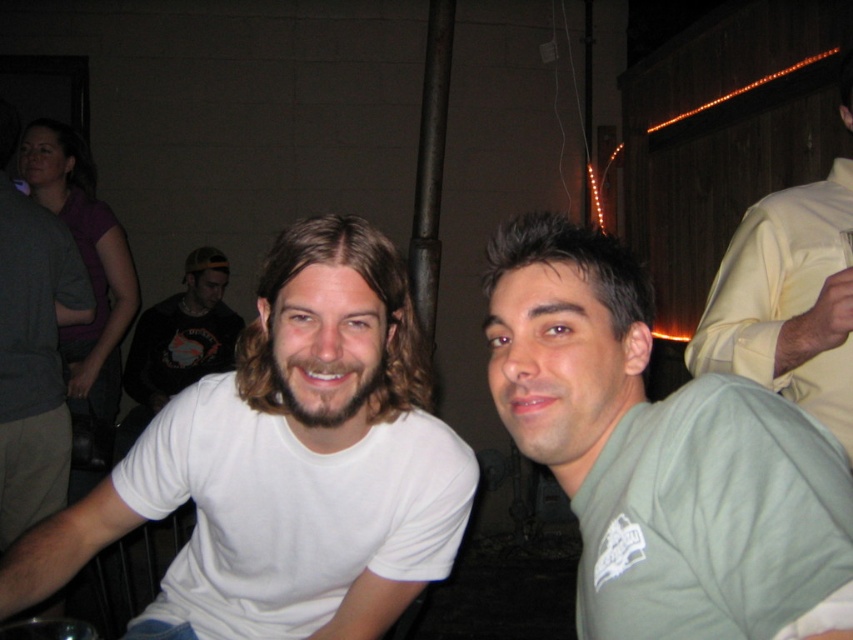
You are at a social gathering and want to take a photo of the black cotton shirt at center without the dark gray shirt at left blocking it. How should you position yourself to achieve this?

The dark gray shirt at left is in front of the black cotton shirt at center, so you should move to a position behind the dark gray shirt at left to capture the black cotton shirt at center without obstruction.